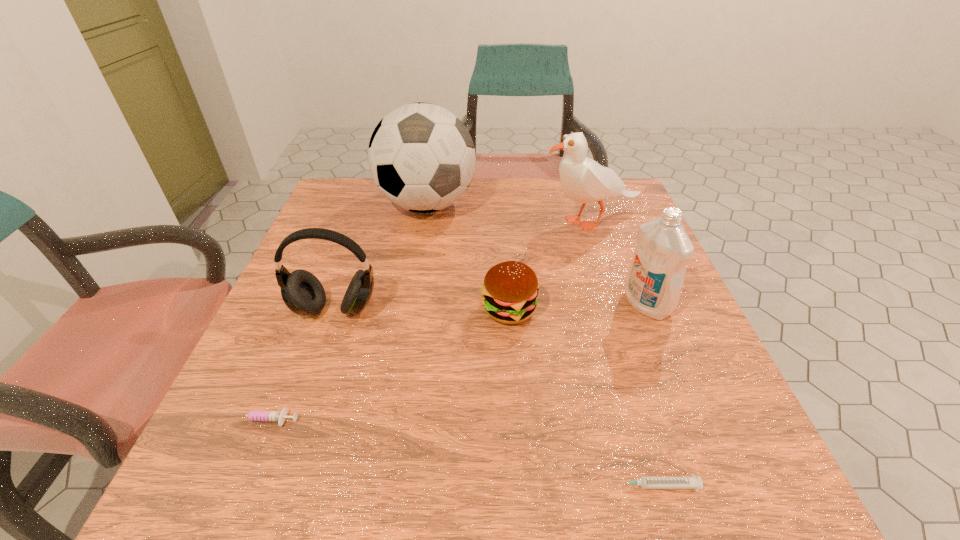
Where is `vacant area that lies between the fifth tallest object and the fourth tallest object`? The width and height of the screenshot is (960, 540). vacant area that lies between the fifth tallest object and the fourth tallest object is located at coordinates (422, 309).

The width and height of the screenshot is (960, 540). I want to click on free spot between the soccer ball and the hamburger, so click(468, 257).

Locate an element on the screen. vacant space in between the detergent and the gull is located at coordinates (618, 263).

Locate an element on the screen. empty space between the detergent and the soccer ball is located at coordinates (537, 254).

Find the location of a particular element. The height and width of the screenshot is (540, 960). vacant area that lies between the left syringe and the fourth tallest object is located at coordinates (298, 364).

Locate an element on the screen. vacant area that lies between the detergent and the fifth tallest object is located at coordinates (578, 307).

Where is `vacant area that lies between the gull and the nearer syringe`? The width and height of the screenshot is (960, 540). vacant area that lies between the gull and the nearer syringe is located at coordinates click(623, 354).

In order to click on blank region between the farther syringe and the nearest object in this screenshot , I will do `click(457, 453)`.

Choose which object is the nearest neighbor to the detergent. Please provide its 2D coordinates. Your answer should be formatted as a tuple, i.e. [(x, y)], where the tuple contains the x and y coordinates of a point satisfying the conditions above.

[(583, 180)]

Locate an element on the screen. This screenshot has height=540, width=960. object that is the second closest to the fourth shortest object is located at coordinates (510, 290).